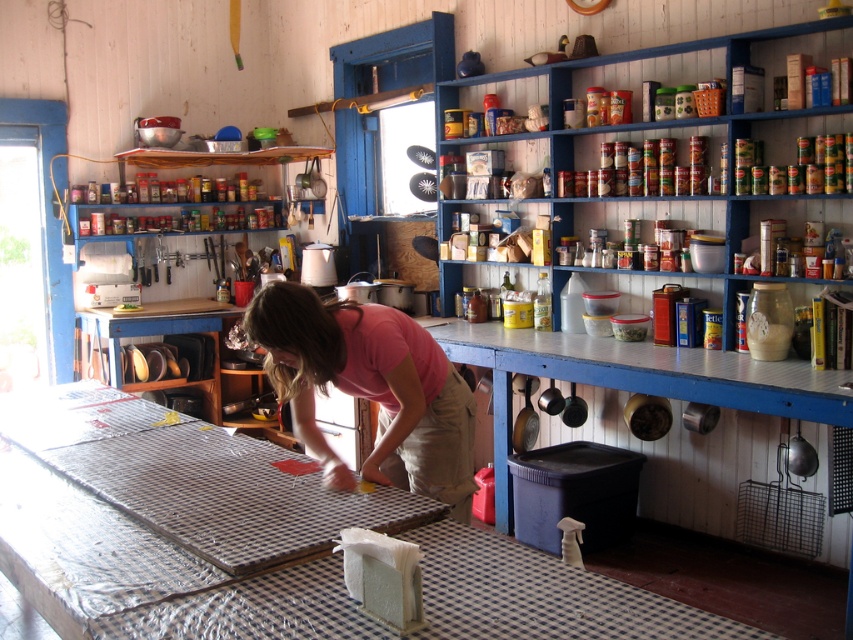
You are a guest in this kitchen and want to place a small vase on the nearest available surface. Which object should you choose between the checkered fabric workbench at center and the blue painted wood shelves at upper right?

The checkered fabric workbench at center is in front of the blue painted wood shelves at upper right, so it is closer to you. Therefore, you should place the vase on the checkered fabric workbench at center.

You are a visitor in this rustic kitchen and need to locate the metallic cans at upper center. According to the scene, where would you find them relative to the checkered fabric workbench at center?

The metallic cans at upper center are located above the checkered fabric workbench at center.

You are standing in the rustic kitchen and want to place a small bowl on the table. Which object, the checkered fabric workbench at center or the pink fabric at center, is nearer to you where you should place it?

The checkered fabric workbench at center is closer to the viewer than the pink fabric at center, so you should place the small bowl on the checkered fabric workbench at center.